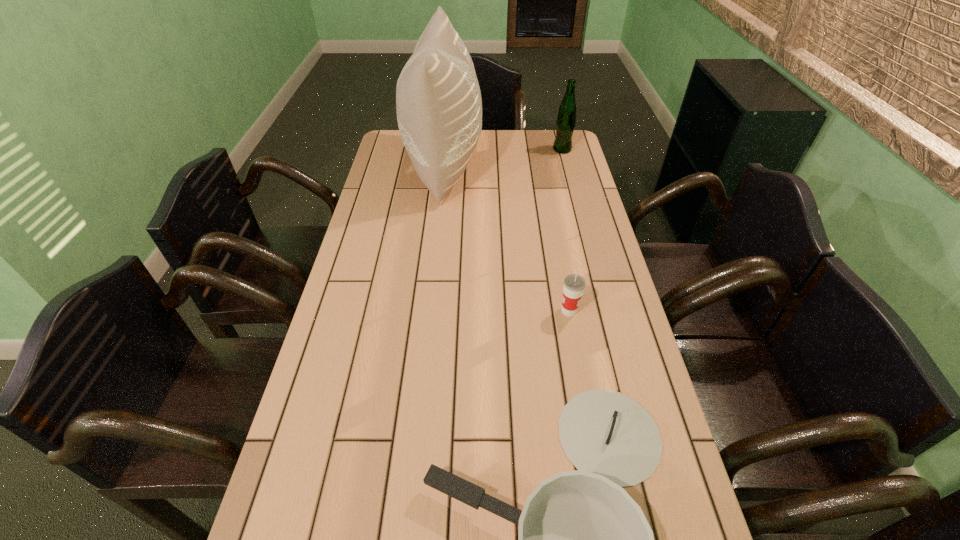
This screenshot has height=540, width=960. In order to click on free area in between the tallest object and the third shortest object in this screenshot , I will do `click(503, 158)`.

Locate an element on the screen. This screenshot has width=960, height=540. free area in between the second nearest object and the cushion is located at coordinates (507, 239).

The width and height of the screenshot is (960, 540). I want to click on the third closest object to the second tallest object, so click(x=582, y=539).

The width and height of the screenshot is (960, 540). Find the location of `object that is the second nearest to the cushion`. object that is the second nearest to the cushion is located at coordinates (573, 288).

Locate an element on the screen. The image size is (960, 540). free space that satisfies the following two spatial constraints: 1. on the front side of the third shortest object; 2. on the front side of the cushion is located at coordinates (566, 167).